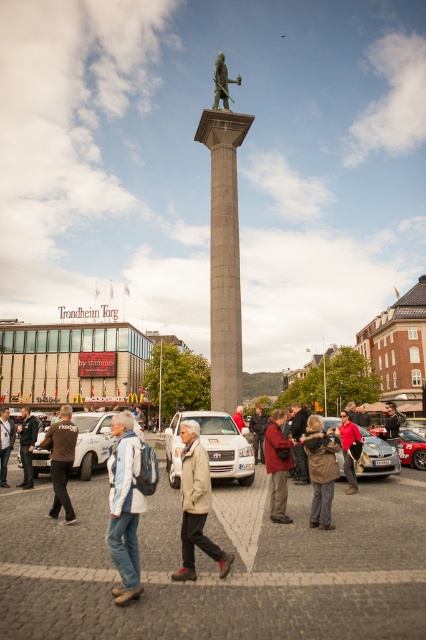
Between brown leather jacket at lower left and bronze statue at center, which one has more height?

brown leather jacket at lower left

I want to click on brown leather jacket at lower left, so click(x=62, y=461).

Who is more distant from viewer, (60, 484) or (215, 77)?

Positioned behind is point (215, 77).

This screenshot has height=640, width=426. Find the location of `brown leather jacket at lower left`. brown leather jacket at lower left is located at coordinates (62, 461).

Is red woolen sweater at center shorter than dark gray jacket at center?

No, red woolen sweater at center is not shorter than dark gray jacket at center.

Can you confirm if red woolen sweater at center is positioned above dark gray jacket at center?

Indeed, red woolen sweater at center is positioned over dark gray jacket at center.

Is point (273, 472) positioned behind point (261, 426)?

No, (273, 472) is closer to viewer.

What are the coordinates of `red woolen sweater at center` in the screenshot? It's located at (278, 465).

Measure the distance between brown leather jacket at lower left and light brown leather jacket at lower left.

brown leather jacket at lower left and light brown leather jacket at lower left are 9.05 meters apart.

Can you confirm if brown leather jacket at lower left is positioned below light brown leather jacket at lower left?

No.

Is point (66, 452) closer to viewer compared to point (23, 474)?

Yes, point (66, 452) is in front of point (23, 474).

The width and height of the screenshot is (426, 640). In order to click on brown leather jacket at lower left in this screenshot , I will do `click(62, 461)`.